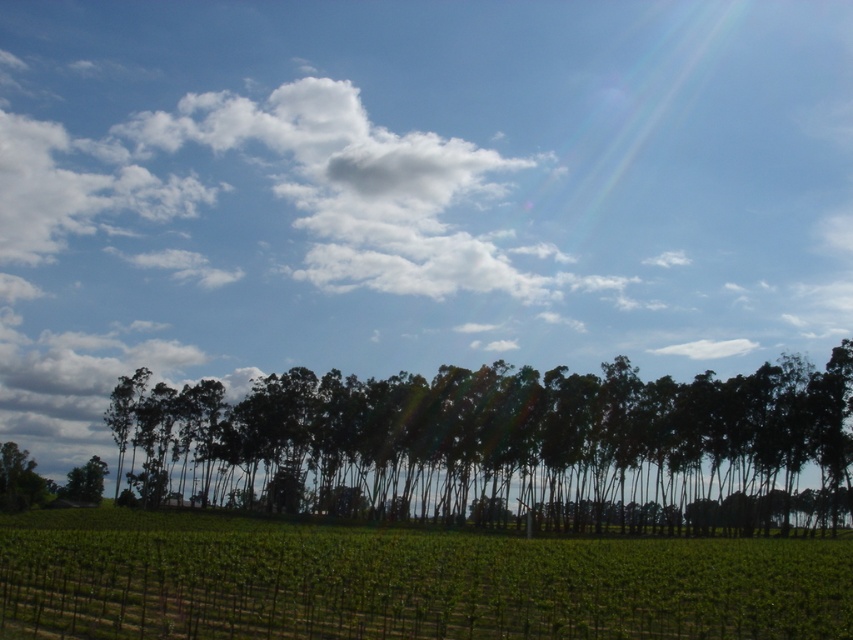
You are a farmer checking the growth of your crops. You notice the dark green trees at center and the green leafy vineyard at center. Which one has a greater height?

The dark green trees at center is taller than green leafy vineyard at center.

You are a farmer inspecting your crops and notice two features in the center of your field. You see the dark green trees at center and the green leafy vineyard at center. Which one is located to the right side of the other?

The dark green trees at center is positioned on the right side of green leafy vineyard at center.